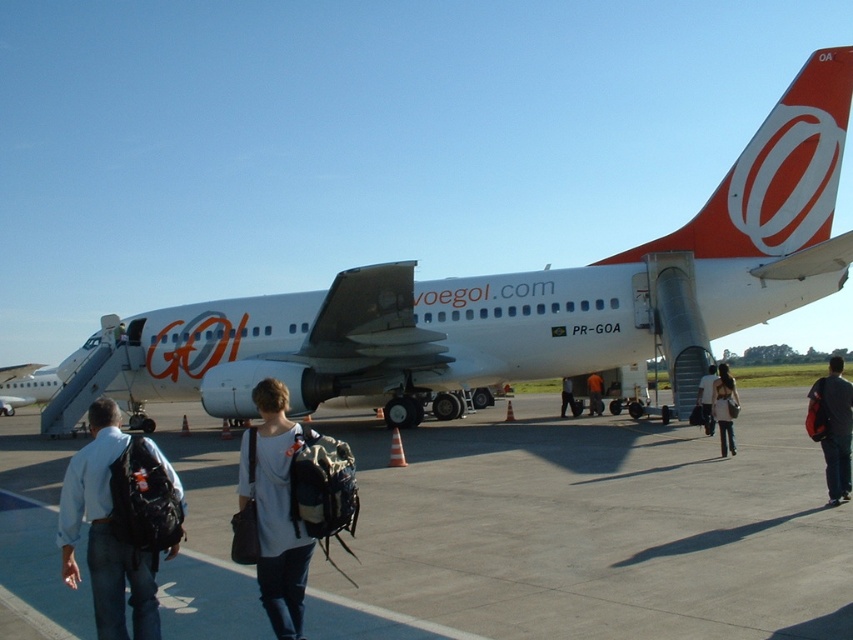
You are standing at the airport gate looking at the Gol aircraft. There are two points marked on the plane. The first point is at coordinates point (x=757, y=220) and the second is at point (x=596, y=372). Which point is closer to your current position?

Point (x=757, y=220) is closer to the camera than point (x=596, y=372), so the first point is closer to your current position.